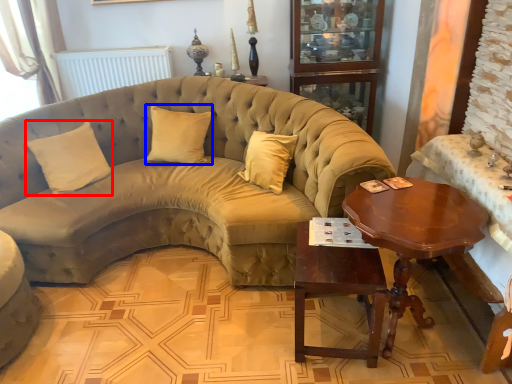
Question: Which of the following is the farthest to the observer, pillow (highlighted by a red box) or pillow (highlighted by a blue box)?

Choices:
 (A) pillow
 (B) pillow

Answer: (B)